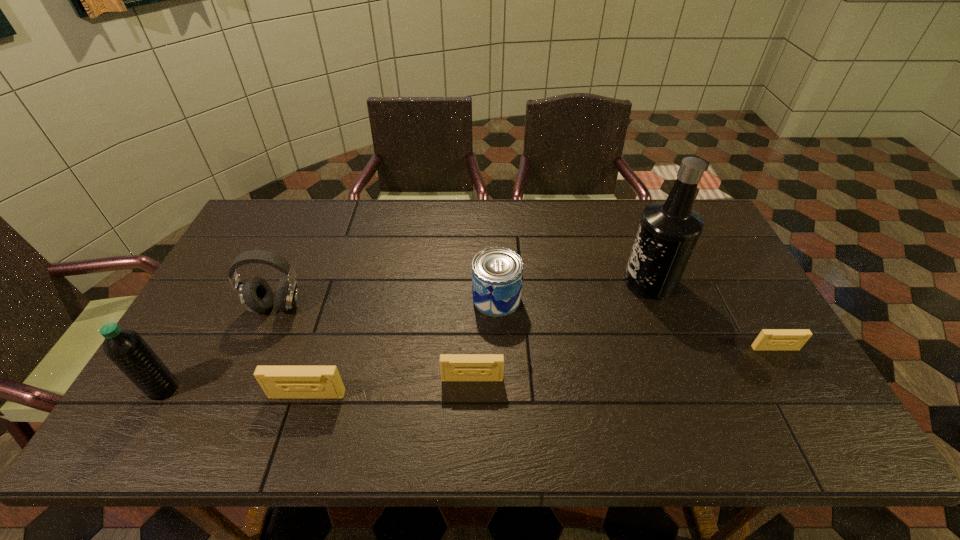
Please point a location where one more videotape can be added evenly. Please provide its 2D coordinates. Your answer should be formatted as a tuple, i.e. [(x, y)], where the tuple contains the x and y coordinates of a point satisfying the conditions above.

[(628, 363)]